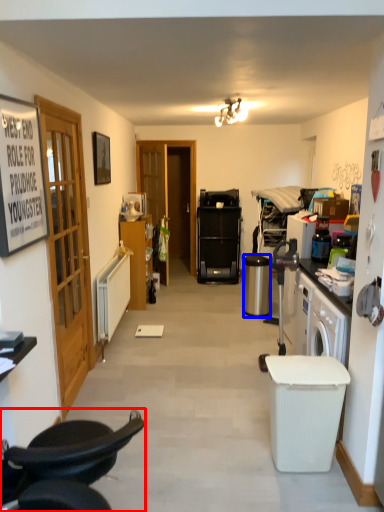
Question: Which of the following is the farthest to the observer, chair (highlighted by a red box) or trash bin/can (highlighted by a blue box)?

Choices:
 (A) chair
 (B) trash bin/can

Answer: (B)